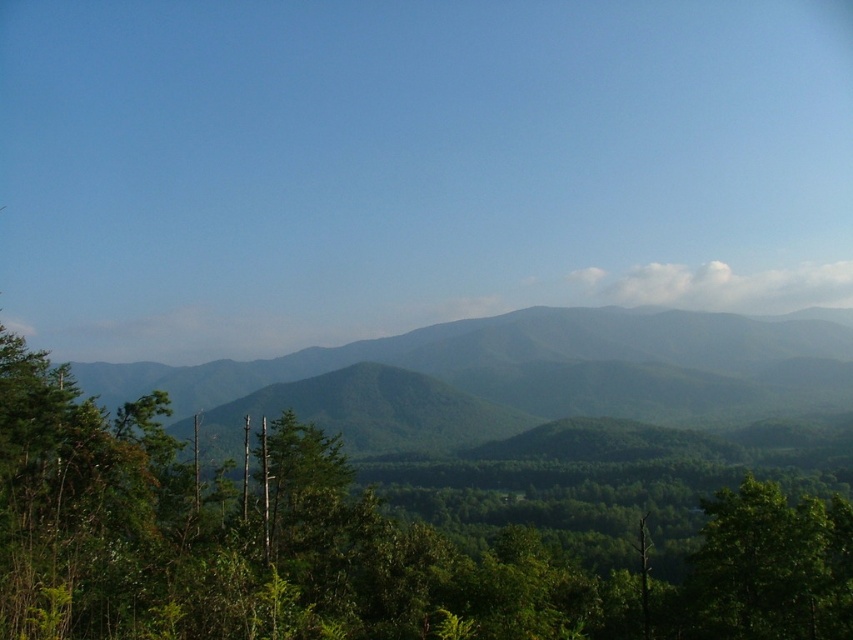
Question: Which point is closer to the camera taking this photo?

Choices:
 (A) (178, 406)
 (B) (706, 596)
 (C) (271, 577)

Answer: (C)

Question: Which of the following is the farthest from the observer?

Choices:
 (A) (723, 499)
 (B) (120, 371)
 (C) (131, 632)

Answer: (B)

Question: Which point is farther from the camera taking this photo?

Choices:
 (A) (65, 470)
 (B) (222, 406)
 (C) (811, 531)

Answer: (B)

Question: Is green matte mountain range at center bigger than green leafy tree at lower right?

Choices:
 (A) no
 (B) yes

Answer: (B)

Question: In this image, where is green leafy tree at center located relative to green matte mountain range at center?

Choices:
 (A) right
 (B) left

Answer: (B)

Question: Does green leafy tree at center appear over green leafy tree at lower right?

Choices:
 (A) no
 (B) yes

Answer: (A)